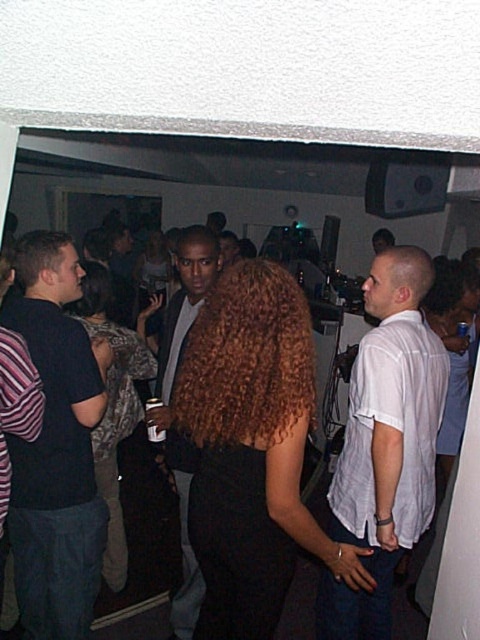
Is matte black dress at center wider than leather jacket at center?

Yes.

From the picture: Is matte black dress at center to the right of leather jacket at center from the viewer's perspective?

Incorrect, matte black dress at center is not on the right side of leather jacket at center.

Find the location of a particular element. matte black dress at center is located at coordinates (115, 404).

Between point (396, 464) and point (145, 244), which one is positioned behind?

Positioned behind is point (145, 244).

Who is taller, white cotton shirt at right or curly hair at center?

white cotton shirt at right is taller.

Is point (418, 269) positioned before point (164, 241)?

Yes, point (418, 269) is closer to viewer.

The width and height of the screenshot is (480, 640). I want to click on white cotton shirt at right, so click(385, 444).

Does dark blue shirt at center appear on the left side of matte black dress at center?

Yes, dark blue shirt at center is to the left of matte black dress at center.

Locate an element on the screen. This screenshot has width=480, height=640. dark blue shirt at center is located at coordinates (57, 449).

Identify the location of dark blue shirt at center. Image resolution: width=480 pixels, height=640 pixels. (57, 449).

Where is `dark blue shirt at center`? Image resolution: width=480 pixels, height=640 pixels. dark blue shirt at center is located at coordinates (57, 449).